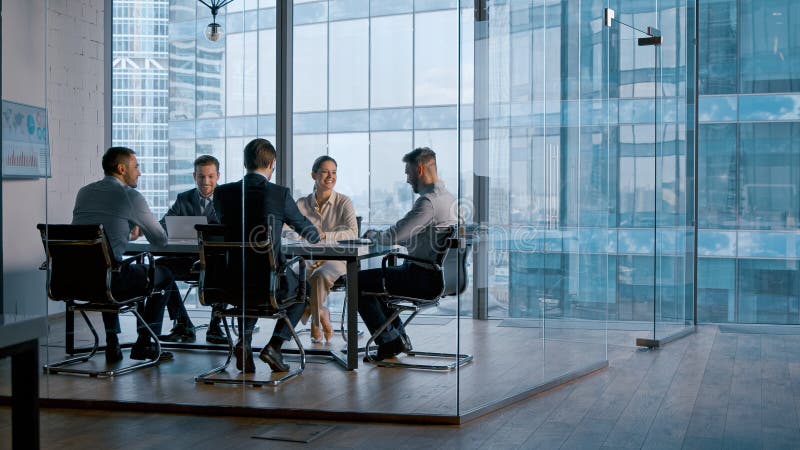
Image resolution: width=800 pixels, height=450 pixels. I want to click on armrests of chairs, so click(x=384, y=258), click(x=294, y=260), click(x=136, y=255), click(x=197, y=265), click(x=42, y=267).